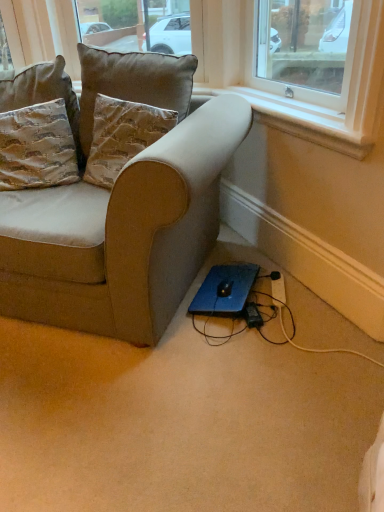
Question: Does suede textured pillow at upper left, the second pillow from the right, have a larger size compared to black plastic plug at lower center?

Choices:
 (A) yes
 (B) no

Answer: (A)

Question: Would you say black plastic plug at lower center is part of suede textured pillow at upper left, the second pillow from the left,'s contents?

Choices:
 (A) no
 (B) yes

Answer: (A)

Question: From a real-world perspective, is suede textured pillow at upper left, the second pillow from the right, positioned under black plastic plug at lower center based on gravity?

Choices:
 (A) no
 (B) yes

Answer: (A)

Question: Considering the relative sizes of suede textured pillow at upper left, the second pillow from the left, and black plastic plug at lower center in the image provided, is suede textured pillow at upper left, the second pillow from the left, wider than black plastic plug at lower center?

Choices:
 (A) yes
 (B) no

Answer: (A)

Question: Can you confirm if suede textured pillow at upper left, the second pillow from the right, is shorter than black plastic plug at lower center?

Choices:
 (A) yes
 (B) no

Answer: (B)

Question: Would you say suede textured pillow at upper left, the second pillow from the left, is outside black plastic plug at lower center?

Choices:
 (A) yes
 (B) no

Answer: (A)

Question: From the image's perspective, is suede textured pillow at upper left, the second pillow from the left, on top of suede beige couch at lower left?

Choices:
 (A) yes
 (B) no

Answer: (A)

Question: Are suede textured pillow at upper left, the second pillow from the right, and suede beige couch at lower left far apart?

Choices:
 (A) no
 (B) yes

Answer: (A)

Question: Considering the relative sizes of suede textured pillow at upper left, the second pillow from the left, and suede beige couch at lower left in the image provided, is suede textured pillow at upper left, the second pillow from the left, shorter than suede beige couch at lower left?

Choices:
 (A) no
 (B) yes

Answer: (B)

Question: Can you confirm if suede textured pillow at upper left, the second pillow from the left, is bigger than suede beige couch at lower left?

Choices:
 (A) no
 (B) yes

Answer: (A)

Question: Can you confirm if suede textured pillow at upper left, the second pillow from the right, is thinner than suede beige couch at lower left?

Choices:
 (A) yes
 (B) no

Answer: (A)

Question: From a real-world perspective, does suede textured pillow at upper left, the second pillow from the right, stand above suede beige couch at lower left?

Choices:
 (A) yes
 (B) no

Answer: (A)

Question: Considering the relative sizes of suede beige couch at lower left and black plastic extension cord at lower right in the image provided, is suede beige couch at lower left taller than black plastic extension cord at lower right?

Choices:
 (A) no
 (B) yes

Answer: (B)